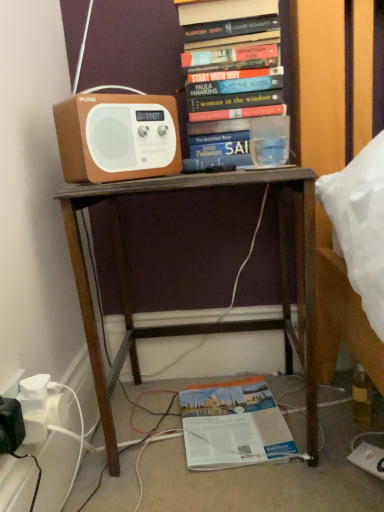
Question: Visually, is brown matte speaker at upper left positioned to the left or to the right of orange paper book at lower center, which appears as the 1th book when ordered from the bottom?

Choices:
 (A) right
 (B) left

Answer: (B)

Question: From a real-world perspective, is brown matte speaker at upper left physically located above or below orange paper book at lower center, the 2th book from the top?

Choices:
 (A) above
 (B) below

Answer: (A)

Question: Estimate the real-world distances between objects in this image. Which object is closer to the brown matte speaker at upper left?

Choices:
 (A) hardcover books at upper center, placed as the second book when sorted from bottom to top
 (B) orange paper book at lower center, the 2th book from the top
 (C) brown wooden desk at center

Answer: (A)

Question: Which object is the farthest from the brown wooden desk at center?

Choices:
 (A) orange paper book at lower center, the 2th book from the top
 (B) hardcover books at upper center, positioned as the 1th book in top-to-bottom order
 (C) brown matte speaker at upper left

Answer: (B)